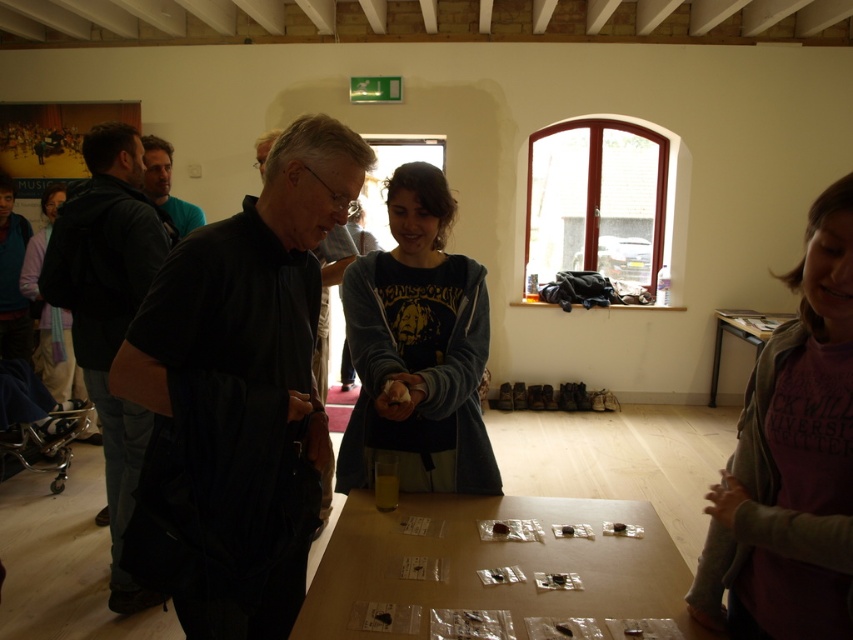
You are organizing a clothing display in the workshop and need to arrange the black leather jacket at left and the matte black jacket at left according to their positions. Which jacket is positioned further to the left?

The matte black jacket at left is positioned further to the left since the black leather jacket at left is to the right of it.

You are a photographer who needs to move your camera closer to the black leather jacket at left to take a better shot. How much distance do you need to move the camera towards the jacket?

The camera and the black leather jacket at left are 2.27 meters apart, so you need to move the camera 2.27 meters closer to the jacket to take the shot.

You are organizing a workshop and need to place a matte black jacket at left on the clear plastic table at center. Will the jacket fit on the table?

The clear plastic table at center might be wider than matte black jacket at left, so there is a possibility that the jacket will fit, but it is uncertain. Check the exact dimensions for confirmation.